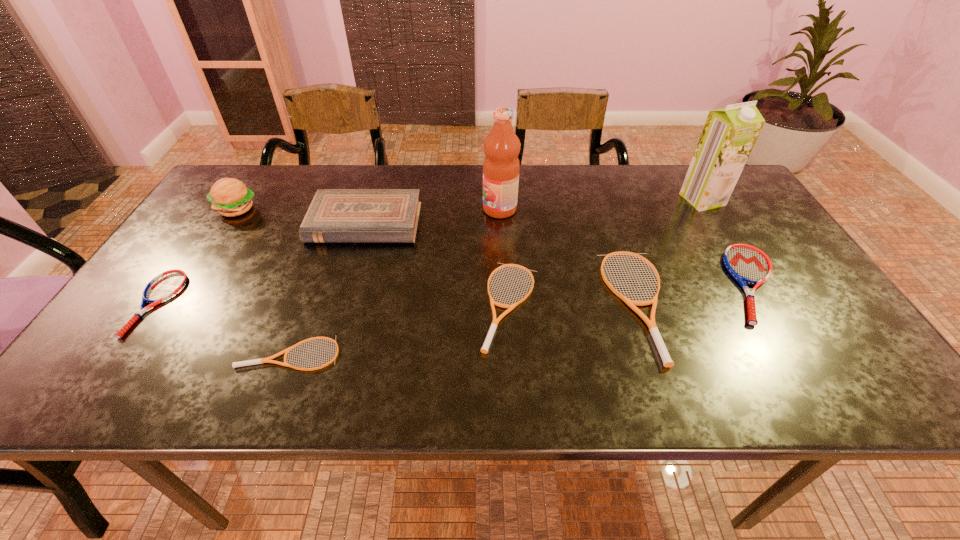
Find the location of a particular element. The width and height of the screenshot is (960, 540). vacant region that satisfies the following two spatial constraints: 1. on the front label of the fruit juice; 2. on the spine side of the blue Bible is located at coordinates (500, 223).